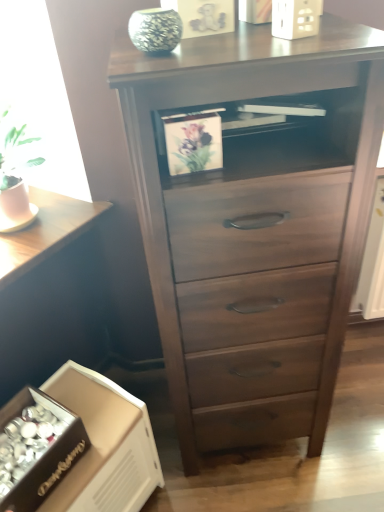
Question: From a real-world perspective, is dark wood chest of drawers at center positioned above or below white cardboard box at lower left?

Choices:
 (A) above
 (B) below

Answer: (A)

Question: Considering the relative positions of dark wood chest of drawers at center and white cardboard box at lower left in the image provided, is dark wood chest of drawers at center to the left or to the right of white cardboard box at lower left?

Choices:
 (A) right
 (B) left

Answer: (A)

Question: Based on their relative distances, which object is farther from the white cardboard box at lower left?

Choices:
 (A) dark wood table at lower left
 (B) dark wood chest of drawers at center
 (C) green textured vase at upper center

Answer: (C)

Question: Considering the real-world distances, which object is farthest from the dark wood chest of drawers at center?

Choices:
 (A) white cardboard box at lower left
 (B) dark wood table at lower left
 (C) green textured vase at upper center

Answer: (B)